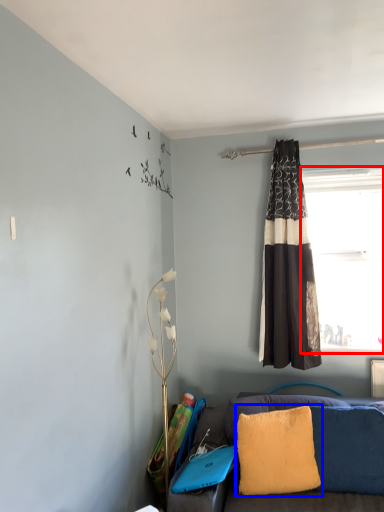
Question: Which object appears closest to the camera in this image, window (highlighted by a red box) or pillow (highlighted by a blue box)?

Choices:
 (A) window
 (B) pillow

Answer: (B)